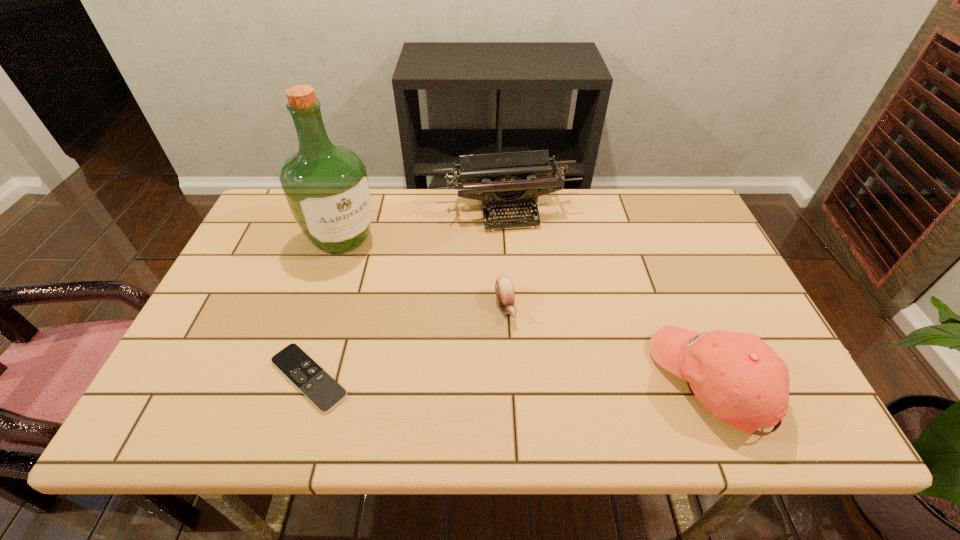
You are a GUI agent. You are given a task and a screenshot of the screen. Output one action in this format:
    pyautogui.click(x=<x>, y=<y>)
    Task: Click on the shortest object
    
    Given the screenshot: What is the action you would take?
    pyautogui.click(x=316, y=384)

Locate an element on the screen. This screenshot has height=540, width=960. baseball cap is located at coordinates (740, 379).

Identify the location of the tallest object. (327, 187).

Find the location of a particular element. This screenshot has height=540, width=960. the second shortest object is located at coordinates (504, 288).

This screenshot has height=540, width=960. Find the location of `escargot`. escargot is located at coordinates [x=504, y=288].

You are a GUI agent. You are given a task and a screenshot of the screen. Output one action in this format:
    pyautogui.click(x=<x>, y=<y>)
    Task: Click on the typewriter
    Image resolution: width=960 pixels, height=540 pixels.
    Given the screenshot: What is the action you would take?
    pyautogui.click(x=505, y=180)

Where is `blank area located on the right of the shortest object`? The width and height of the screenshot is (960, 540). blank area located on the right of the shortest object is located at coordinates (512, 378).

Where is `free space located on the front-facing side of the rightmost object`? The width and height of the screenshot is (960, 540). free space located on the front-facing side of the rightmost object is located at coordinates (574, 381).

The image size is (960, 540). Find the location of `vacant space located 0.060m on the front-facing side of the rightmost object`. vacant space located 0.060m on the front-facing side of the rightmost object is located at coordinates (630, 381).

Where is `vacant area situated 0.340m on the front-facing side of the rightmost object`? vacant area situated 0.340m on the front-facing side of the rightmost object is located at coordinates (500, 381).